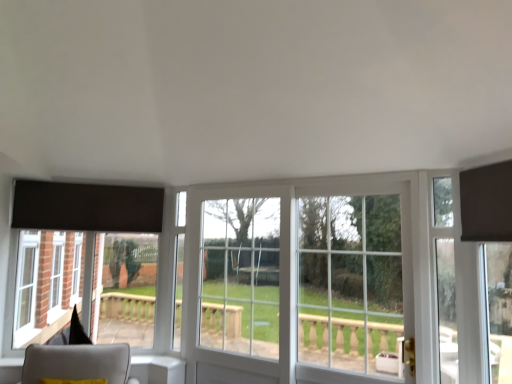
Describe the element at coordinates (486, 203) in the screenshot. I see `matte black curtain at upper right` at that location.

Based on the photo, what is the approximate width of clear glass door at right?

clear glass door at right is 5.15 inches wide.

Based on the photo, what is the approximate height of clear glass window at center?

clear glass window at center is 1.54 meters tall.

The width and height of the screenshot is (512, 384). Find the location of `clear glass door at center`. clear glass door at center is located at coordinates (242, 289).

Between matte black curtain at upper right and clear glass door at right, which one appears on the left side from the viewer's perspective?

From the viewer's perspective, clear glass door at right appears more on the left side.

Is matte black curtain at upper right beside clear glass door at right?

No, matte black curtain at upper right is not in contact with clear glass door at right.

Identify the location of curtain above the clear glass door at right (from a real-world perspective). The height and width of the screenshot is (384, 512). (486, 203).

Considering their positions, is matte black curtain at upper right located in front of or behind clear glass door at right?

Clearly, matte black curtain at upper right is in front of clear glass door at right.

How distant is light gray fabric chair at lower left from clear glass window at center?

They are 3.70 feet apart.

Are light gray fabric chair at lower left and clear glass window at center beside each other?

No.

Is light gray fabric chair at lower left oriented towards clear glass window at center?

No.

Consider the image. Which is nearer, (80,349) or (218,325)?

The point (80,349) is closer to the camera.

Is clear glass door at right oriented away from clear glass door at center?

That's not correct — clear glass door at right is not looking away from clear glass door at center.

Is clear glass door at right beside clear glass door at center?

No.

From the image's perspective, which is below, clear glass door at right or clear glass door at center?

From the image's view, clear glass door at center is below.

Considering the sizes of clear glass door at right and clear glass door at center in the image, is clear glass door at right wider or thinner than clear glass door at center?

Considering their sizes, clear glass door at right looks broader than clear glass door at center.

From a real-world perspective, does clear glass door at center sit lower than matte black curtain at upper right?

Correct, in the physical world, clear glass door at center is lower than matte black curtain at upper right.

Is clear glass door at center with matte black curtain at upper right?

No, clear glass door at center is not next to matte black curtain at upper right.

Considering the relative sizes of clear glass door at center and matte black curtain at upper right in the image provided, is clear glass door at center taller than matte black curtain at upper right?

Correct, clear glass door at center is much taller as matte black curtain at upper right.

Could you tell me if clear glass door at center is turned towards matte black curtain at upper right?

No, clear glass door at center is not aimed at matte black curtain at upper right.

Is clear glass window at center beside light gray fabric chair at lower left?

clear glass window at center is not next to light gray fabric chair at lower left, and they're not touching.

Is clear glass window at center located outside light gray fabric chair at lower left?

Yes, clear glass window at center is located beyond the bounds of light gray fabric chair at lower left.

Is light gray fabric chair at lower left at the back of clear glass window at center?

No, clear glass window at center is not facing the opposite direction of light gray fabric chair at lower left.

Is clear glass door at center looking in the opposite direction of clear glass window at center?

Absolutely, clear glass door at center is directed away from clear glass window at center.

From the picture: From a real-world perspective, which is physically below, clear glass door at center or clear glass window at center?

clear glass door at center.

Find the location of a particular element. This screenshot has height=384, width=512. screen door that appears on the left of clear glass window at center is located at coordinates (242, 289).

Does point (382, 311) lie behind point (503, 168)?

Yes, it is.

Looking at this image, which of these two, clear glass door at right or matte black curtain at upper right, stands taller?

clear glass door at right is taller.

Who is smaller, clear glass door at right or matte black curtain at upper right?

Smaller between the two is matte black curtain at upper right.

Is clear glass door at right looking in the opposite direction of matte black curtain at upper right?

No, matte black curtain at upper right is not at the back of clear glass door at right.

Find the location of a particular element. glass door below the matte black curtain at upper right (from a real-world perspective) is located at coordinates (350, 281).

This screenshot has width=512, height=384. Find the location of `window above the light gray fabric chair at lower left (from a real-world perspective)`. window above the light gray fabric chair at lower left (from a real-world perspective) is located at coordinates (298, 281).

Looking at the image, which one is located closer to clear glass door at right, clear glass window at center or clear glass door at center?

clear glass window at center lies closer to clear glass door at right than the other object.

Estimate the real-world distances between objects in this image. Which object is further from matte black curtain at upper right, clear glass door at center or light gray fabric chair at lower left?

Among the two, light gray fabric chair at lower left is located further to matte black curtain at upper right.

Looking at the image, which one is located closer to clear glass door at center, light gray fabric chair at lower left or matte black curtain at upper right?

Among the two, light gray fabric chair at lower left is located nearer to clear glass door at center.

Which object lies further to the anchor point clear glass door at right, light gray fabric chair at lower left or clear glass door at center?

light gray fabric chair at lower left lies further to clear glass door at right than the other object.

Looking at the image, which one is located further to clear glass window at center, clear glass door at right or matte black curtain at upper right?

The object further to clear glass window at center is matte black curtain at upper right.

Which object lies further to the anchor point clear glass window at center, light gray fabric chair at lower left or clear glass door at right?

light gray fabric chair at lower left is further to clear glass window at center.

Considering their positions, is clear glass door at right positioned further to light gray fabric chair at lower left than matte black curtain at upper right?

matte black curtain at upper right lies further to light gray fabric chair at lower left than the other object.

From the image, which object appears to be farther from clear glass window at center, clear glass door at right or light gray fabric chair at lower left?

The object further to clear glass window at center is light gray fabric chair at lower left.

Where is `screen door located between light gray fabric chair at lower left and clear glass door at right in the left-right direction`? This screenshot has width=512, height=384. screen door located between light gray fabric chair at lower left and clear glass door at right in the left-right direction is located at coordinates [x=242, y=289].

I want to click on window between light gray fabric chair at lower left and matte black curtain at upper right in the horizontal direction, so click(x=298, y=281).

This screenshot has height=384, width=512. What are the coordinates of `screen door between light gray fabric chair at lower left and clear glass window at center in the horizontal direction` in the screenshot? It's located at (242, 289).

At what (x,y) coordinates should I click in order to perform the action: click on screen door situated between light gray fabric chair at lower left and matte black curtain at upper right from left to right. Please return your answer as a coordinate pair (x, y). Looking at the image, I should click on (242, 289).